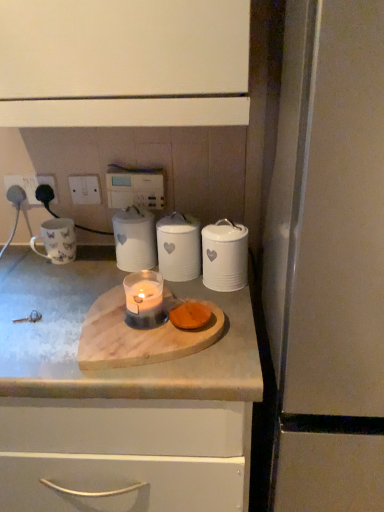
This screenshot has width=384, height=512. I want to click on free space behind translucent glass candle at center, so click(x=127, y=282).